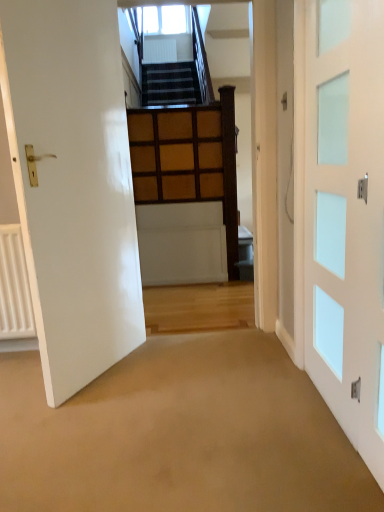
How much space does white glass door at right, which appears as the 2th door when viewed from the left, occupy horizontally?

white glass door at right, which appears as the 2th door when viewed from the left, is 1.77 inches wide.

What do you see at coordinates (165, 19) in the screenshot? The width and height of the screenshot is (384, 512). I see `clear glass window at upper center` at bounding box center [165, 19].

In order to face white glossy door at left, arranged as the 2th door when viewed from the right, should I rotate leftwards or rightwards?

A 14.234 degree turn to the left will do.

The image size is (384, 512). Find the location of `white glass door at right, which is the 1th door in right-to-left order`. white glass door at right, which is the 1th door in right-to-left order is located at coordinates (346, 217).

Is the depth of clear glass window at upper center less than that of white glossy door at left, the 1th door in the left-to-right sequence?

No, it is behind white glossy door at left, the 1th door in the left-to-right sequence.

Is clear glass window at upper center far away from white glossy door at left, arranged as the 2th door when viewed from the right?

Yes.

Measure the distance between clear glass window at upper center and white glossy door at left, arranged as the 2th door when viewed from the right.

They are 6.03 feet apart.

Identify the location of window positioned vertically above the white glossy door at left, arranged as the 2th door when viewed from the right (from a real-world perspective). (165, 19).

You are a GUI agent. You are given a task and a screenshot of the screen. Output one action in this format:
    pyautogui.click(x=<x>, y=<y>)
    Task: Click on the window that is behind the white glass door at right, which appears as the 2th door when viewed from the left
    The image size is (384, 512).
    Given the screenshot: What is the action you would take?
    pyautogui.click(x=165, y=19)

Does clear glass window at upper center touch white glass door at right, which appears as the 2th door when viewed from the left?

No, clear glass window at upper center is not with white glass door at right, which appears as the 2th door when viewed from the left.

Between clear glass window at upper center and white glass door at right, which is the 1th door in right-to-left order, which one appears on the left side from the viewer's perspective?

From the viewer's perspective, clear glass window at upper center appears more on the left side.

Is clear glass window at upper center not within white glass door at right, which appears as the 2th door when viewed from the left?

Yes, clear glass window at upper center is outside of white glass door at right, which appears as the 2th door when viewed from the left.

Considering the sizes of objects white glossy door at left, the 1th door in the left-to-right sequence, and clear glass window at upper center in the image provided, who is bigger, white glossy door at left, the 1th door in the left-to-right sequence, or clear glass window at upper center?

white glossy door at left, the 1th door in the left-to-right sequence, is bigger.

In the scene shown: Is white glossy door at left, the 1th door in the left-to-right sequence, in front of or behind clear glass window at upper center in the image?

white glossy door at left, the 1th door in the left-to-right sequence, is positioned closer to the viewer than clear glass window at upper center.

Could you tell me if white glossy door at left, the 1th door in the left-to-right sequence, is turned towards clear glass window at upper center?

No, white glossy door at left, the 1th door in the left-to-right sequence, is not turned towards clear glass window at upper center.

Can you confirm if white glossy door at left, arranged as the 2th door when viewed from the right, is wider than clear glass window at upper center?

In fact, white glossy door at left, arranged as the 2th door when viewed from the right, might be narrower than clear glass window at upper center.

Is point (354, 189) in front of point (180, 25)?

That is True.

From a real-world perspective, which object stands above the other?

clear glass window at upper center, from a real-world perspective.

From the image's perspective, which object appears higher, white glass door at right, which is the 1th door in right-to-left order, or clear glass window at upper center?

clear glass window at upper center.

Which is more to the right, white glass door at right, which is the 1th door in right-to-left order, or clear glass window at upper center?

Positioned to the right is white glass door at right, which is the 1th door in right-to-left order.

Which of these two, white glass door at right, which is the 1th door in right-to-left order, or white glossy door at left, arranged as the 2th door when viewed from the right, is thinner?

white glass door at right, which is the 1th door in right-to-left order, is thinner.

In the image, is white glass door at right, which is the 1th door in right-to-left order, on the left side or the right side of white glossy door at left, the 1th door in the left-to-right sequence?

Clearly, white glass door at right, which is the 1th door in right-to-left order, is on the right of white glossy door at left, the 1th door in the left-to-right sequence, in the image.

Is white glass door at right, which is the 1th door in right-to-left order, oriented towards white glossy door at left, the 1th door in the left-to-right sequence?

A: Yes.

Can you confirm if white glossy door at left, the 1th door in the left-to-right sequence, is taller than white glass door at right, which appears as the 2th door when viewed from the left?

Indeed, white glossy door at left, the 1th door in the left-to-right sequence, has a greater height compared to white glass door at right, which appears as the 2th door when viewed from the left.

From the picture: From the image's perspective, is white glossy door at left, the 1th door in the left-to-right sequence, on white glass door at right, which appears as the 2th door when viewed from the left?

Yes, from the image's perspective, white glossy door at left, the 1th door in the left-to-right sequence, is above white glass door at right, which appears as the 2th door when viewed from the left.

From the picture: Considering the relative positions of white glossy door at left, the 1th door in the left-to-right sequence, and white glass door at right, which is the 1th door in right-to-left order, in the image provided, is white glossy door at left, the 1th door in the left-to-right sequence, behind white glass door at right, which is the 1th door in right-to-left order,?

Yes, it is.

Is white glossy door at left, arranged as the 2th door when viewed from the right, touching white glass door at right, which is the 1th door in right-to-left order?

No, white glossy door at left, arranged as the 2th door when viewed from the right, is not in contact with white glass door at right, which is the 1th door in right-to-left order.

This screenshot has height=512, width=384. I want to click on door on the left of clear glass window at upper center, so click(x=73, y=184).

Image resolution: width=384 pixels, height=512 pixels. What are the coordinates of `door lying on the right of clear glass window at upper center` in the screenshot? It's located at (346, 217).

Which object lies nearer to the anchor point white glossy door at left, the 1th door in the left-to-right sequence, white glass door at right, which is the 1th door in right-to-left order, or clear glass window at upper center?

white glass door at right, which is the 1th door in right-to-left order.

Considering their positions, is clear glass window at upper center positioned further to white glossy door at left, the 1th door in the left-to-right sequence, than white glass door at right, which is the 1th door in right-to-left order?

The object further to white glossy door at left, the 1th door in the left-to-right sequence, is clear glass window at upper center.

Estimate the real-world distances between objects in this image. Which object is closer to white glass door at right, which is the 1th door in right-to-left order, white glossy door at left, the 1th door in the left-to-right sequence, or clear glass window at upper center?

The object closer to white glass door at right, which is the 1th door in right-to-left order, is white glossy door at left, the 1th door in the left-to-right sequence.

From the image, which object appears to be farther from clear glass window at upper center, white glass door at right, which appears as the 2th door when viewed from the left, or white glossy door at left, the 1th door in the left-to-right sequence?

white glass door at right, which appears as the 2th door when viewed from the left, is positioned further to the anchor clear glass window at upper center.

Based on their spatial positions, is white glossy door at left, the 1th door in the left-to-right sequence, or white glass door at right, which appears as the 2th door when viewed from the left, closer to clear glass window at upper center?

Based on the image, white glossy door at left, the 1th door in the left-to-right sequence, appears to be nearer to clear glass window at upper center.

Estimate the real-world distances between objects in this image. Which object is closer to white glass door at right, which is the 1th door in right-to-left order, clear glass window at upper center or white glossy door at left, the 1th door in the left-to-right sequence?

Based on the image, white glossy door at left, the 1th door in the left-to-right sequence, appears to be nearer to white glass door at right, which is the 1th door in right-to-left order.

Find the location of a particular element. The height and width of the screenshot is (512, 384). door positioned between white glass door at right, which is the 1th door in right-to-left order, and clear glass window at upper center from near to far is located at coordinates (73, 184).